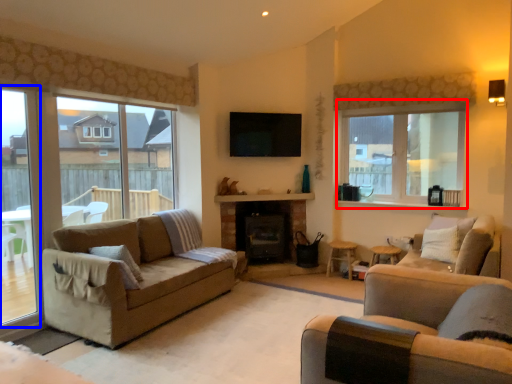
Question: Which point is closer to the camera, window (highlighted by a red box) or window frame (highlighted by a blue box)?

Choices:
 (A) window
 (B) window frame

Answer: (B)